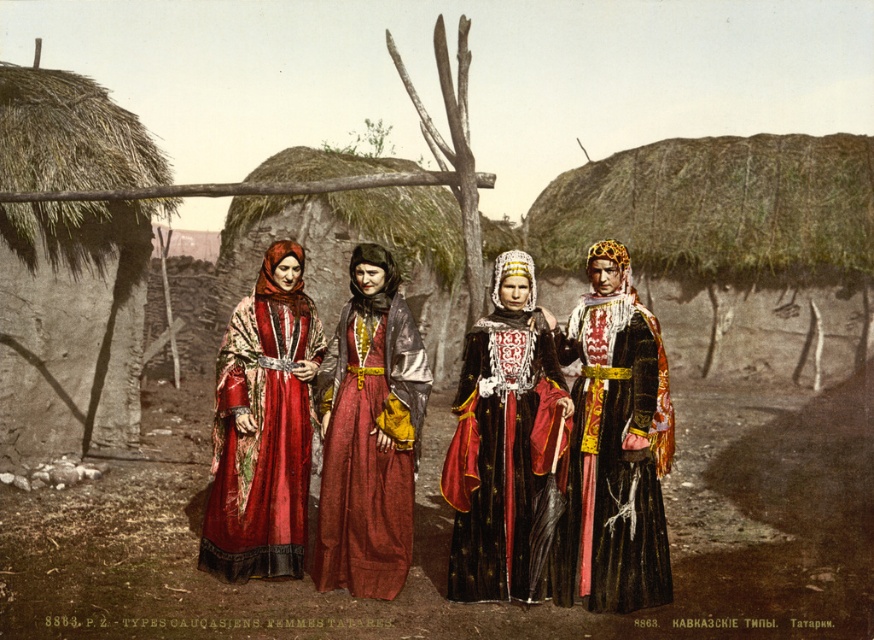
Is point (567, 344) positioned in front of point (411, 477)?

No, it is behind (411, 477).

Is black velvet dress at center positioned behind matte red dress at center?

No, it is not.

Who is more distant from viewer, [656,579] or [399,522]?

The point [399,522] is behind.

This screenshot has width=874, height=640. I want to click on black velvet dress at center, so pos(615,460).

Does point (265, 552) come closer to viewer compared to point (359, 304)?

No.

What do you see at coordinates (262, 428) in the screenshot? I see `shiny red dress at center` at bounding box center [262, 428].

Which is in front, point (241, 572) or point (336, 582)?

Point (336, 582) is more forward.

Where is `shiny red dress at center`? shiny red dress at center is located at coordinates (262, 428).

Does black velvet dress at center have a lesser height compared to shiny red dress at center?

Indeed, black velvet dress at center has a lesser height compared to shiny red dress at center.

Who is positioned more to the left, black velvet dress at center or shiny red dress at center?

shiny red dress at center

Describe the element at coordinates (615, 460) in the screenshot. This screenshot has width=874, height=640. I see `black velvet dress at center` at that location.

Locate an element on the screen. The image size is (874, 640). black velvet dress at center is located at coordinates (615, 460).